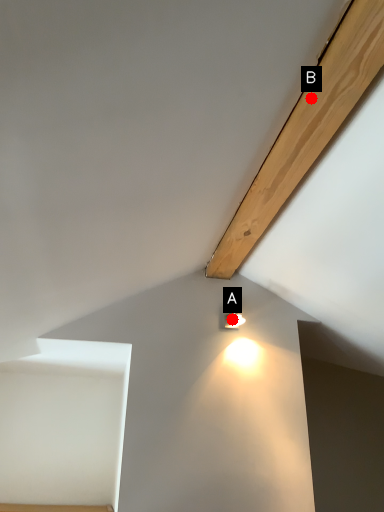
Question: Two points are circled on the image, labeled by A and B beside each circle. Among these points, which one is farthest from the camera?

Choices:
 (A) A is further
 (B) B is further

Answer: (A)